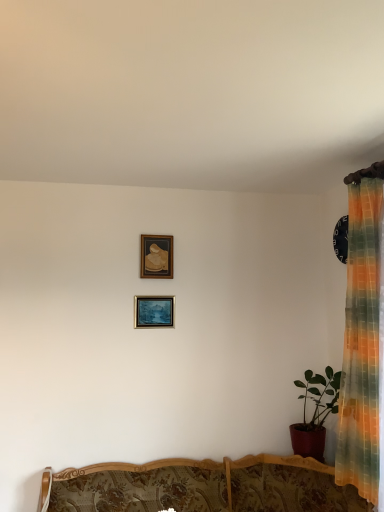
Question: Is matte red pot at right surrounded by matte wooden picture frame at center, the 1th picture frame from the bottom?

Choices:
 (A) yes
 (B) no

Answer: (B)

Question: Is matte wooden picture frame at center, the 1th picture frame from the bottom, far away from matte red pot at right?

Choices:
 (A) no
 (B) yes

Answer: (B)

Question: Does matte wooden picture frame at center, marked as the second picture frame in a top-to-bottom arrangement, have a lesser width compared to matte red pot at right?

Choices:
 (A) no
 (B) yes

Answer: (B)

Question: From a real-world perspective, is matte wooden picture frame at center, marked as the second picture frame in a top-to-bottom arrangement, over matte red pot at right?

Choices:
 (A) no
 (B) yes

Answer: (B)

Question: Is matte wooden picture frame at center, marked as the second picture frame in a top-to-bottom arrangement, smaller than matte red pot at right?

Choices:
 (A) no
 (B) yes

Answer: (B)

Question: Does matte wooden picture frame at center, the 1th picture frame from the bottom, appear on the right side of matte red pot at right?

Choices:
 (A) yes
 (B) no

Answer: (B)

Question: From a real-world perspective, does wooden picture frame at upper center, arranged as the 2th picture frame when ordered from the bottom, stand above matte red pot at right?

Choices:
 (A) yes
 (B) no

Answer: (A)

Question: Is wooden picture frame at upper center, arranged as the 2th picture frame when ordered from the bottom, aimed at matte red pot at right?

Choices:
 (A) yes
 (B) no

Answer: (B)

Question: Does wooden picture frame at upper center, arranged as the 2th picture frame when ordered from the bottom, have a greater height compared to matte red pot at right?

Choices:
 (A) no
 (B) yes

Answer: (A)

Question: Can you confirm if wooden picture frame at upper center, arranged as the 2th picture frame when ordered from the bottom, is smaller than matte red pot at right?

Choices:
 (A) yes
 (B) no

Answer: (A)

Question: From a real-world perspective, is wooden picture frame at upper center, arranged as the first picture frame when viewed from the top, under matte red pot at right?

Choices:
 (A) yes
 (B) no

Answer: (B)

Question: Can you confirm if wooden picture frame at upper center, arranged as the first picture frame when viewed from the top, is thinner than matte red pot at right?

Choices:
 (A) no
 (B) yes

Answer: (B)

Question: From the image's perspective, is matte red pot at right above wooden picture frame at upper center, arranged as the 2th picture frame when ordered from the bottom?

Choices:
 (A) yes
 (B) no

Answer: (B)